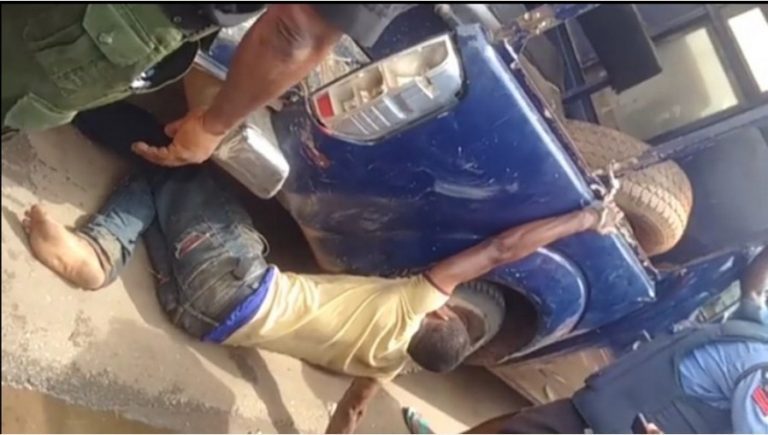
Identify the location of floor. (118, 333).